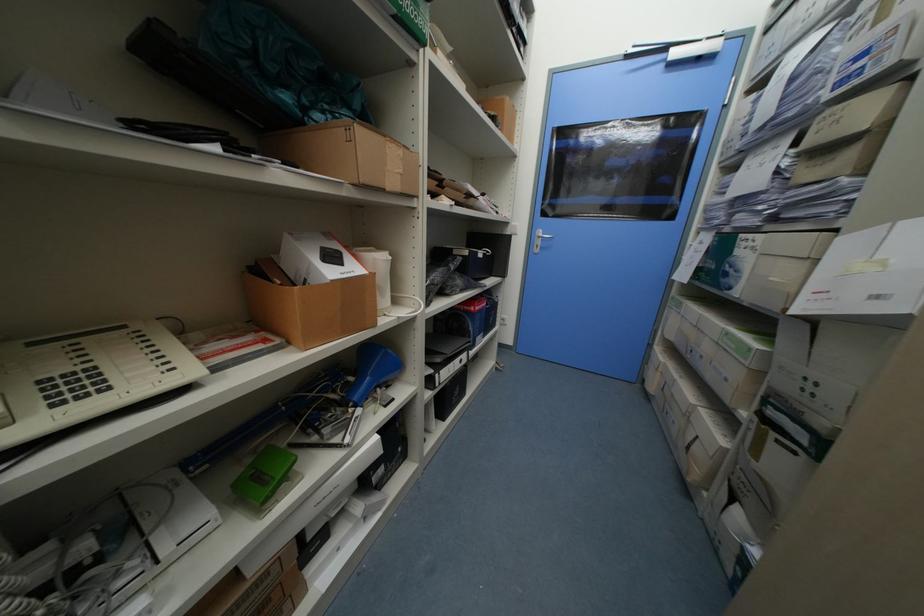
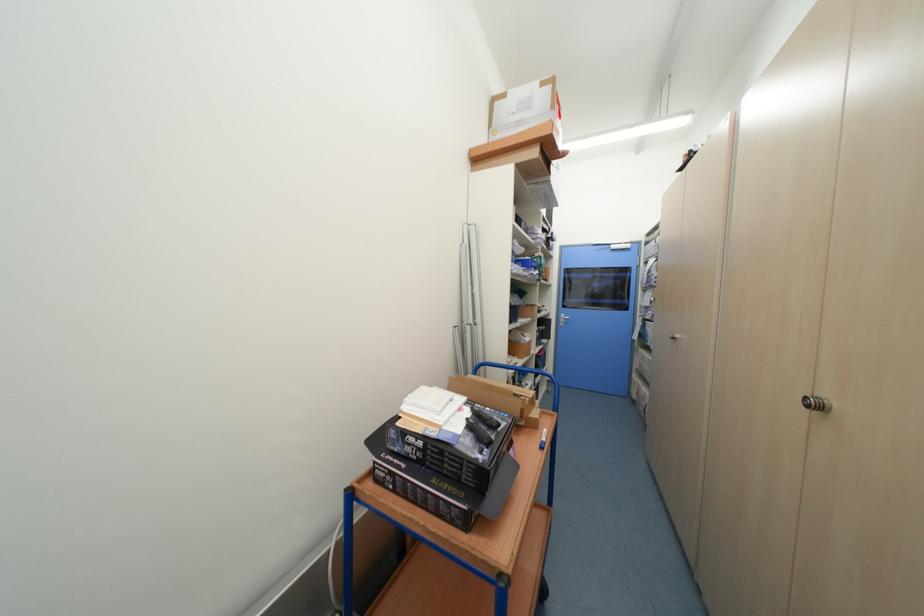
In a continuous first-person perspective shot, in which direction is the camera moving?

The movement direction of the cameraman is left, backward.